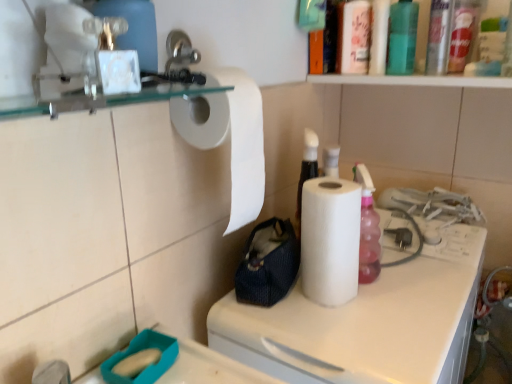
Question: Is translucent plastic bottle at upper right, positioned as the first bottle in front-to-back order, positioned behind navy blue fabric pouch at center?

Choices:
 (A) no
 (B) yes

Answer: (B)

Question: Considering the relative sizes of translucent plastic bottle at upper right, the second bottle in the back-to-front sequence, and navy blue fabric pouch at center in the image provided, is translucent plastic bottle at upper right, the second bottle in the back-to-front sequence, thinner than navy blue fabric pouch at center?

Choices:
 (A) yes
 (B) no

Answer: (A)

Question: Is translucent plastic bottle at upper right, positioned as the first bottle in front-to-back order, smaller than navy blue fabric pouch at center?

Choices:
 (A) no
 (B) yes

Answer: (B)

Question: From a real-world perspective, is translucent plastic bottle at upper right, positioned as the first bottle in front-to-back order, on navy blue fabric pouch at center?

Choices:
 (A) yes
 (B) no

Answer: (A)

Question: Is translucent plastic bottle at upper right, the second bottle in the back-to-front sequence, surrounding navy blue fabric pouch at center?

Choices:
 (A) no
 (B) yes

Answer: (A)

Question: Is white matte paper towel at center spatially inside navy blue fabric pouch at center, or outside of it?

Choices:
 (A) inside
 (B) outside

Answer: (B)

Question: Relative to navy blue fabric pouch at center, is white matte paper towel at center in front or behind?

Choices:
 (A) behind
 (B) front

Answer: (B)

Question: From the image's perspective, is white matte paper towel at center above or below navy blue fabric pouch at center?

Choices:
 (A) above
 (B) below

Answer: (B)

Question: In terms of size, does white matte paper towel at center appear bigger or smaller than navy blue fabric pouch at center?

Choices:
 (A) big
 (B) small

Answer: (A)

Question: Based on their sizes in the image, would you say green matte bottle at upper right, arranged as the first bottle when viewed from the back, is bigger or smaller than white matte paper towel at upper left, which is counted as the 1th paper towel, starting from the left?

Choices:
 (A) big
 (B) small

Answer: (B)

Question: In terms of width, does green matte bottle at upper right, arranged as the first bottle when viewed from the back, look wider or thinner when compared to white matte paper towel at upper left, the second paper towel in the right-to-left sequence?

Choices:
 (A) thin
 (B) wide

Answer: (A)

Question: Considering their positions, is green matte bottle at upper right, which ranks as the second bottle in front-to-back order, located in front of or behind white matte paper towel at upper left, which is counted as the 1th paper towel, starting from the left?

Choices:
 (A) behind
 (B) front

Answer: (A)

Question: From a real-world perspective, is green matte bottle at upper right, arranged as the first bottle when viewed from the back, above or below white matte paper towel at upper left, the second paper towel in the right-to-left sequence?

Choices:
 (A) below
 (B) above

Answer: (B)

Question: Relative to translucent plastic bottle at upper right, positioned as the first bottle in front-to-back order, is white matte paper towel at center in front or behind?

Choices:
 (A) behind
 (B) front

Answer: (B)

Question: Considering the positions of white matte paper towel at center and translucent plastic bottle at upper right, positioned as the first bottle in front-to-back order, in the image, is white matte paper towel at center bigger or smaller than translucent plastic bottle at upper right, positioned as the first bottle in front-to-back order,?

Choices:
 (A) small
 (B) big

Answer: (B)